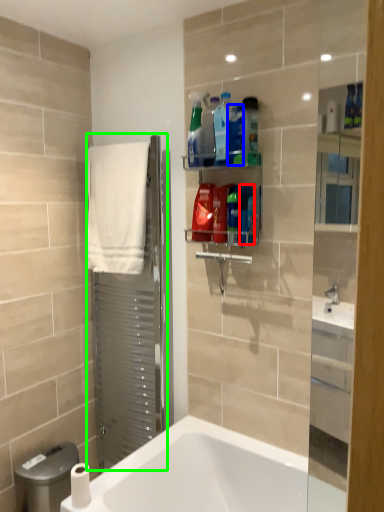
Question: Which is nearer to the cleaning product (highlighted by a red box)? product (highlighted by a blue box) or screen door (highlighted by a green box).

Choices:
 (A) product
 (B) screen door

Answer: (A)